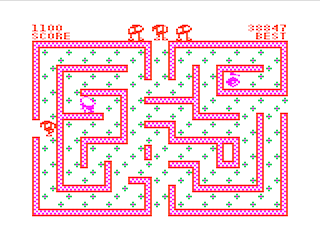
Find the location of `walls`. walls is located at coordinates (122, 130).